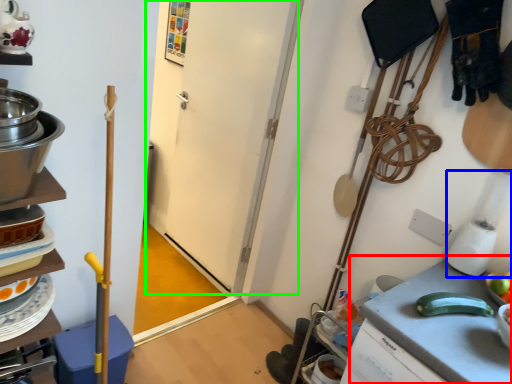
Question: Which is farther away from counter top (highlighted by a red box)? blender (highlighted by a blue box) or door (highlighted by a green box)?

Choices:
 (A) blender
 (B) door

Answer: (B)